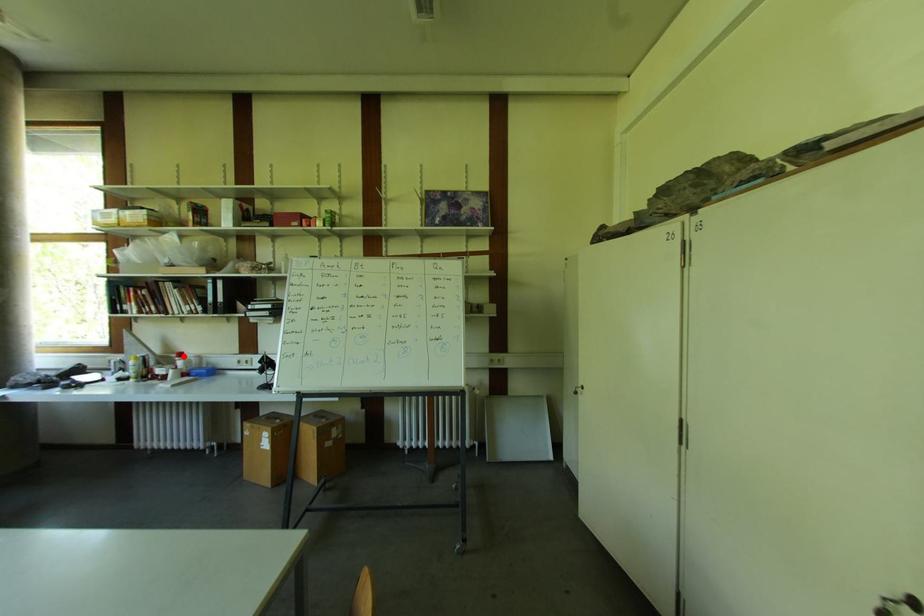
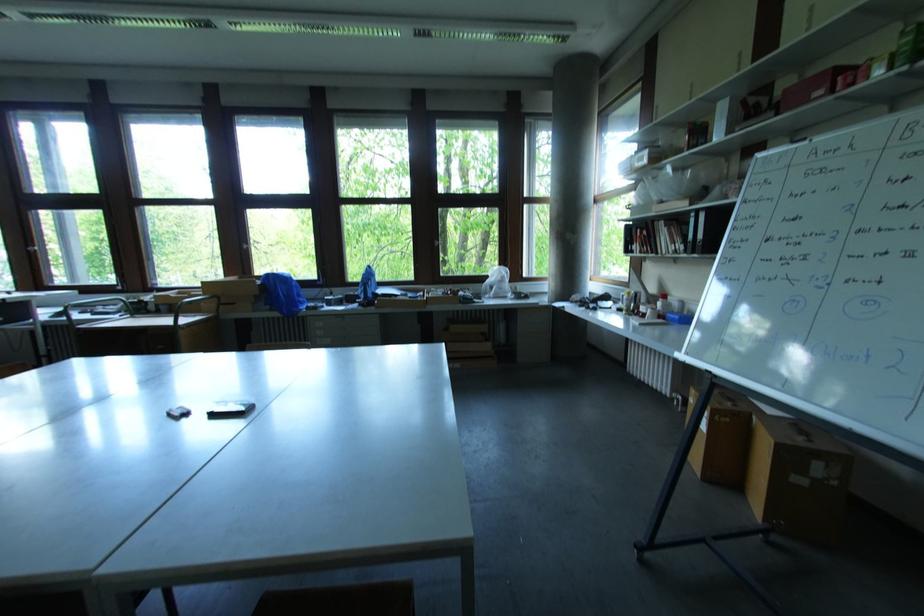
Find the pixel in the second image that matches the highlighted location in the first image.

(667, 298)